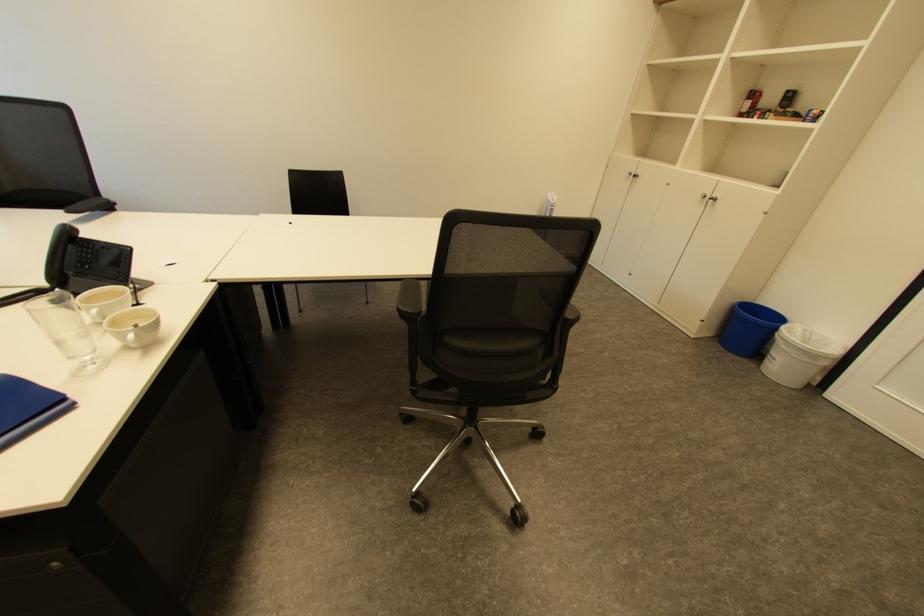
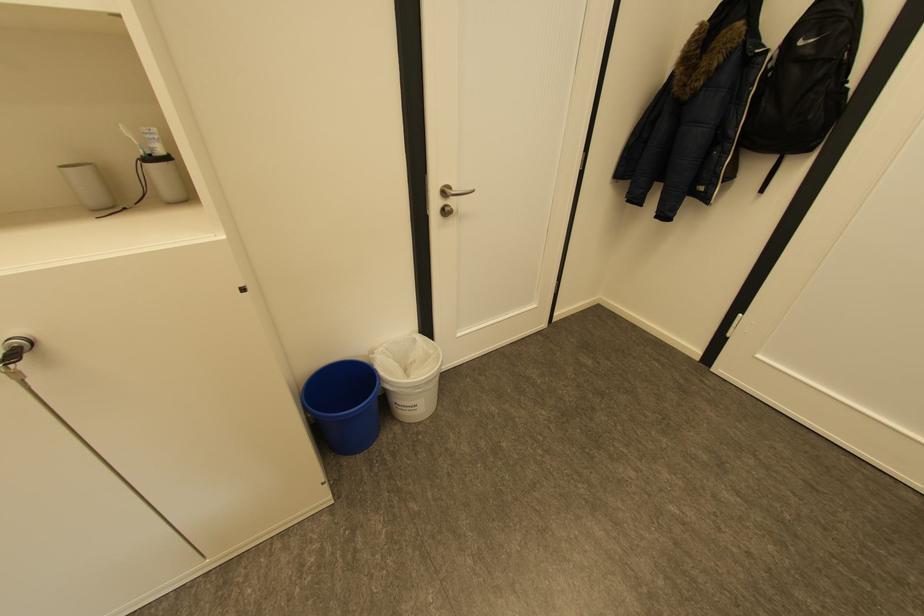
Find the pixel in the second image that matches point (819, 331) in the first image.

(394, 349)